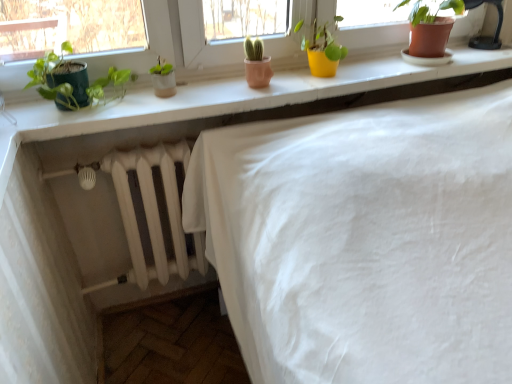
Find the location of `free region under terracotta clay pot at upper right, which is the first houseplant in right-to-left order (from a real-world perspective)`. free region under terracotta clay pot at upper right, which is the first houseplant in right-to-left order (from a real-world perspective) is located at coordinates (422, 63).